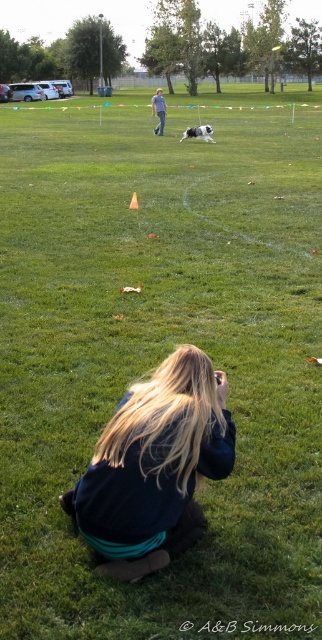
You are a photographer trying to capture the perfect shot of the dog and frisbee. You notice the blonde hair at lower center and blue jeans at center in your viewfinder. Which object should you adjust your focus to ensure the subject is centered? Explain your reasoning.

The blue jeans at center should be adjusted because the blonde hair at lower center is shorter than the blue jeans at center, meaning the jeans are closer to the dog and frisbee, so focusing on them would help center the subject.

What are the coordinates of the blonde hair at lower center in the image?

The coordinates of the blonde hair at lower center are at point (154, 467).

You are a photographer trying to capture the scene. Since you want to focus on the person, which part of the person should you adjust your camera to prioritize? The blonde hair at lower center or the blue jeans at center?

The blonde hair at lower center is closer to the viewer than the blue jeans at center, so you should adjust your camera to prioritize focusing on the blonde hair at lower center for better clarity.